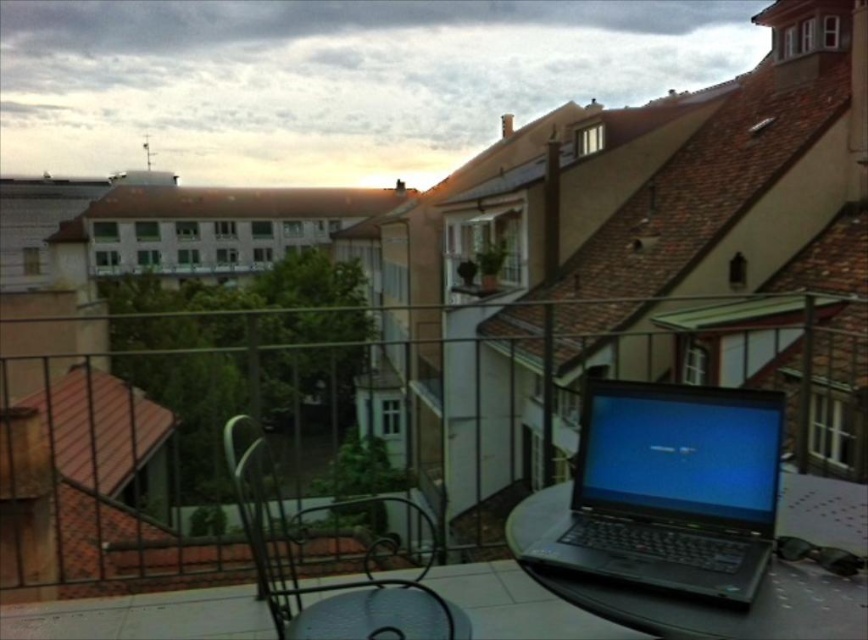
Question: Considering the relative positions of black matte laptop at center and black wrought iron chair at center in the image provided, where is black matte laptop at center located with respect to black wrought iron chair at center?

Choices:
 (A) below
 (B) above

Answer: (B)

Question: Which object is closer to the camera taking this photo?

Choices:
 (A) black glass table at lower right
 (B) black matte laptop at center

Answer: (A)

Question: Which point is farther from the camera taking this photo?

Choices:
 (A) (718, 625)
 (B) (339, 625)
 (C) (389, 536)

Answer: (C)

Question: Does black wrought iron chair at center have a smaller size compared to transparent glass table at center?

Choices:
 (A) no
 (B) yes

Answer: (A)

Question: Which point is closer to the camera taking this photo?

Choices:
 (A) (307, 634)
 (B) (850, 588)
 (C) (380, 602)
 (D) (758, 509)

Answer: (B)

Question: Does black glass table at lower right have a larger size compared to transparent glass table at center?

Choices:
 (A) yes
 (B) no

Answer: (A)